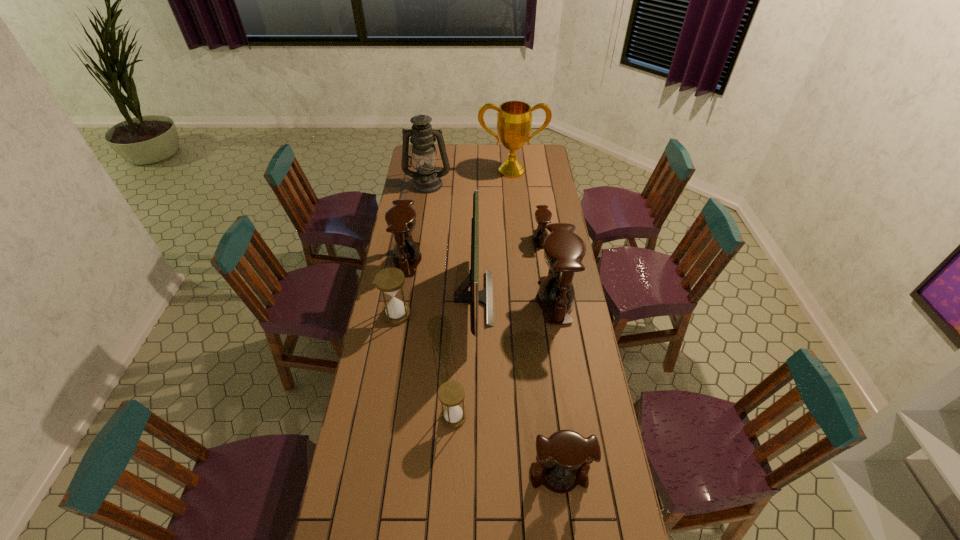
Where is `free space located on the back of the nearest hourglass`? This screenshot has height=540, width=960. free space located on the back of the nearest hourglass is located at coordinates (550, 400).

Where is `free spot located 0.350m on the front of the smallest brown hourglass`? free spot located 0.350m on the front of the smallest brown hourglass is located at coordinates (549, 305).

At what (x,y) coordinates should I click in order to perform the action: click on vacant space situated 0.210m on the left of the second nearest object. Please return your answer as a coordinate pair (x, y). Looking at the image, I should click on (380, 417).

You are a GUI agent. You are given a task and a screenshot of the screen. Output one action in this format:
    pyautogui.click(x=<x>, y=<y>)
    Task: Click on the object that is at the far edge
    
    Given the screenshot: What is the action you would take?
    pyautogui.click(x=514, y=118)

The image size is (960, 540). I want to click on oil lamp that is at the left edge, so click(x=426, y=179).

Locate an element on the screen. award that is at the right edge is located at coordinates (514, 118).

Find the location of a particular element. This screenshot has width=960, height=540. object positioned at the far right corner is located at coordinates (514, 118).

The width and height of the screenshot is (960, 540). In the image, there is a desktop. In order to click on free space at the far edge in this screenshot , I will do `click(482, 146)`.

The image size is (960, 540). Find the location of `free space at the left edge of the desktop`. free space at the left edge of the desktop is located at coordinates (371, 469).

Identify the location of vacant space at the right edge of the desktop. The image size is (960, 540). (540, 195).